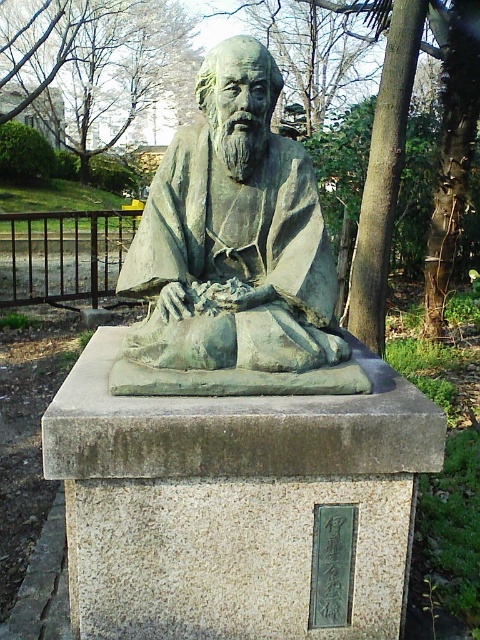
Question: Can you confirm if green patina statue at center is positioned to the right of green leafy tree at upper left?

Choices:
 (A) yes
 (B) no

Answer: (A)

Question: Can you confirm if green patina statue at center is wider than green leafy tree at upper left?

Choices:
 (A) no
 (B) yes

Answer: (A)

Question: Is green patina statue at center behind green leafy tree at upper left?

Choices:
 (A) yes
 (B) no

Answer: (B)

Question: Among these points, which one is nearest to the camera?

Choices:
 (A) (203, 227)
 (B) (191, 36)

Answer: (A)